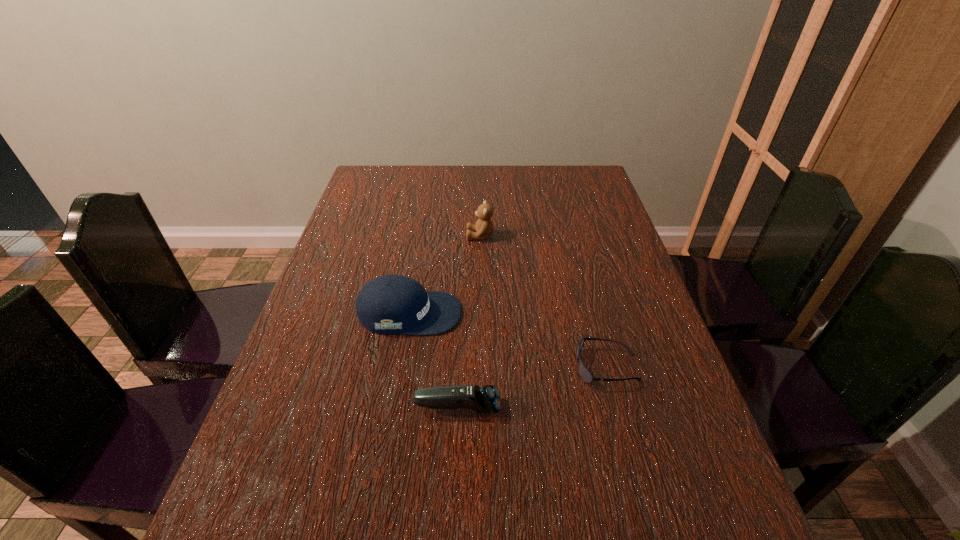
The height and width of the screenshot is (540, 960). In order to click on free space at the far right corner of the desktop in this screenshot , I will do `click(593, 165)`.

The width and height of the screenshot is (960, 540). Find the location of `vacant point located between the farthest object and the shortest object`. vacant point located between the farthest object and the shortest object is located at coordinates (543, 301).

You are a GUI agent. You are given a task and a screenshot of the screen. Output one action in this format:
    pyautogui.click(x=<x>, y=<y>)
    Task: Click on the unoccupied position between the nearest object and the baseball cap
    The width and height of the screenshot is (960, 540).
    Given the screenshot: What is the action you would take?
    pyautogui.click(x=434, y=360)

Locate an element on the screen. The height and width of the screenshot is (540, 960). unoccupied position between the shortest object and the electric shaver is located at coordinates (532, 387).

Image resolution: width=960 pixels, height=540 pixels. I want to click on free space between the baseball cap and the second nearest object, so click(x=508, y=340).

What are the coordinates of `free point between the third farthest object and the electric shaver` in the screenshot? It's located at (532, 387).

Find the location of a particular element. free space between the baseball cap and the shortest object is located at coordinates (508, 340).

This screenshot has width=960, height=540. I want to click on free space between the nearest object and the shortest object, so click(x=532, y=387).

Find the location of a particular element. The image size is (960, 540). free space between the baseball cap and the teddy bear is located at coordinates (444, 274).

Where is `free area in between the second farthest object and the third tallest object`? The width and height of the screenshot is (960, 540). free area in between the second farthest object and the third tallest object is located at coordinates (434, 360).